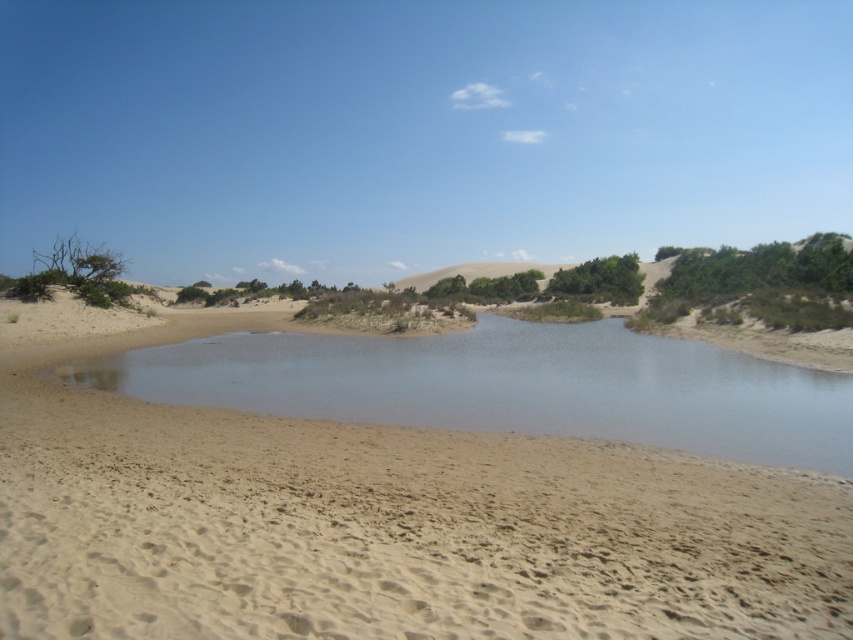
You are standing at the origin point of the coordinate system in the desert scene. You want to walk to the light brown sandy beach at center. Which direction should you move in terms of the coordinate system?

The light brown sandy beach at center is located at coordinate point 0.809 on the x axis and 0.440 on the y axis. To reach it from the origin, you should move towards increasing x and y directions.

You are planning to cross the desert and need to know which area is wider between the light brown sandy beach at center and the clear water at center. Which one is wider?

The light brown sandy beach at center is wider than the clear water at center according to the description.